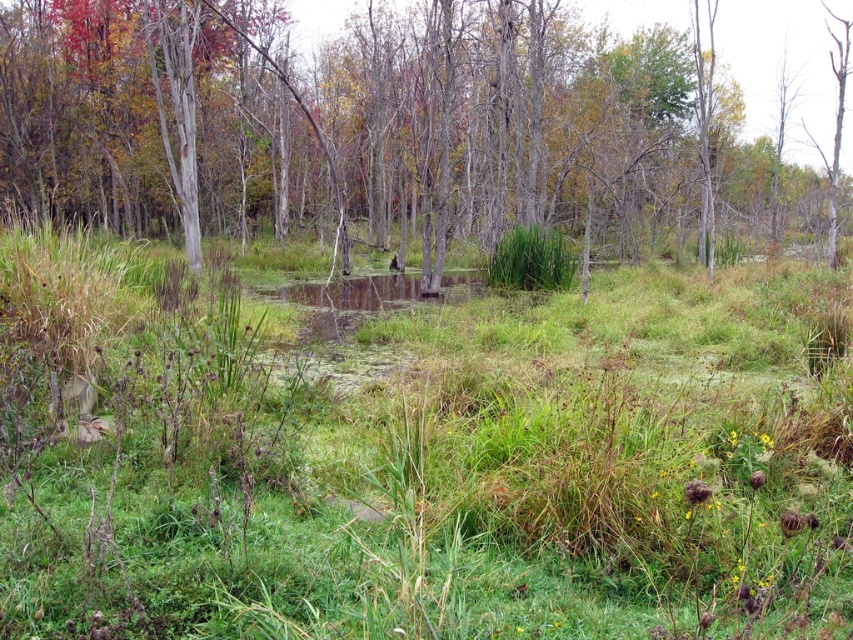
Question: Is green grassy at center smaller than green grass at center?

Choices:
 (A) yes
 (B) no

Answer: (A)

Question: Is green grassy at center positioned at the back of green grass at center?

Choices:
 (A) yes
 (B) no

Answer: (B)

Question: Which of the following is the closest to the observer?

Choices:
 (A) green grass at center
 (B) green grassy at center

Answer: (B)

Question: Which object is farther from the camera taking this photo?

Choices:
 (A) green grass at center
 (B) green grassy at center

Answer: (A)

Question: Is green grassy at center wider than green grass at center?

Choices:
 (A) yes
 (B) no

Answer: (B)

Question: Which of the following is the farthest from the observer?

Choices:
 (A) (573, 344)
 (B) (596, 168)

Answer: (B)